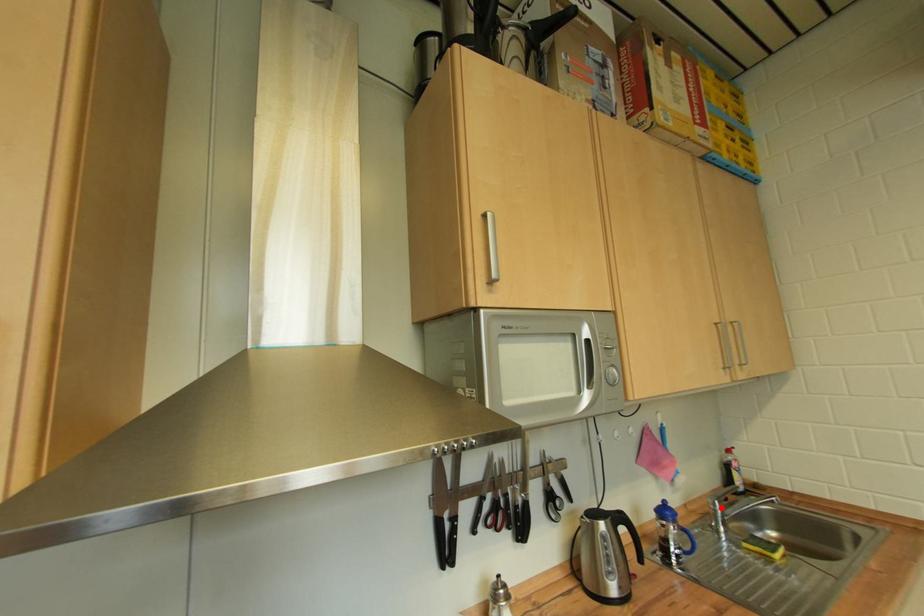
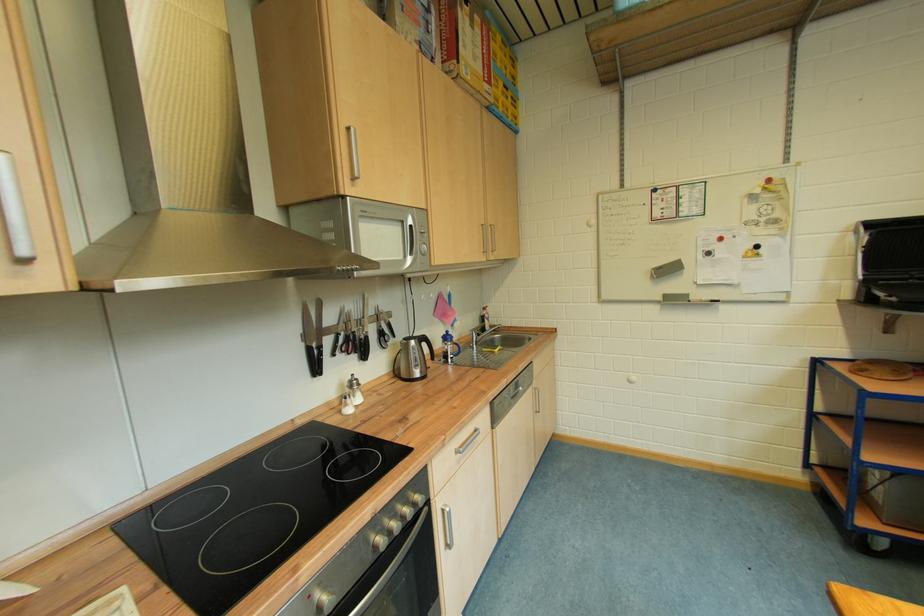
Where in the second image is the point corresponding to the highlighted location from the first image?

(480, 336)